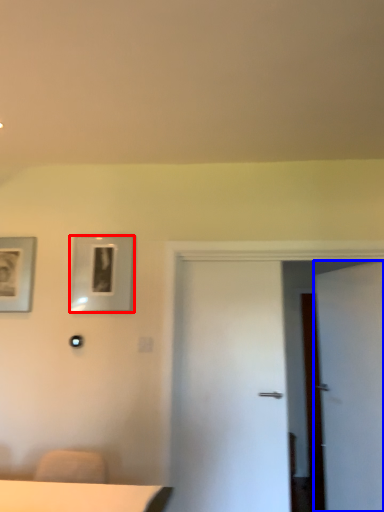
Question: Which point is closer to the camera, picture frame (highlighted by a red box) or door (highlighted by a blue box)?

Choices:
 (A) picture frame
 (B) door

Answer: (B)